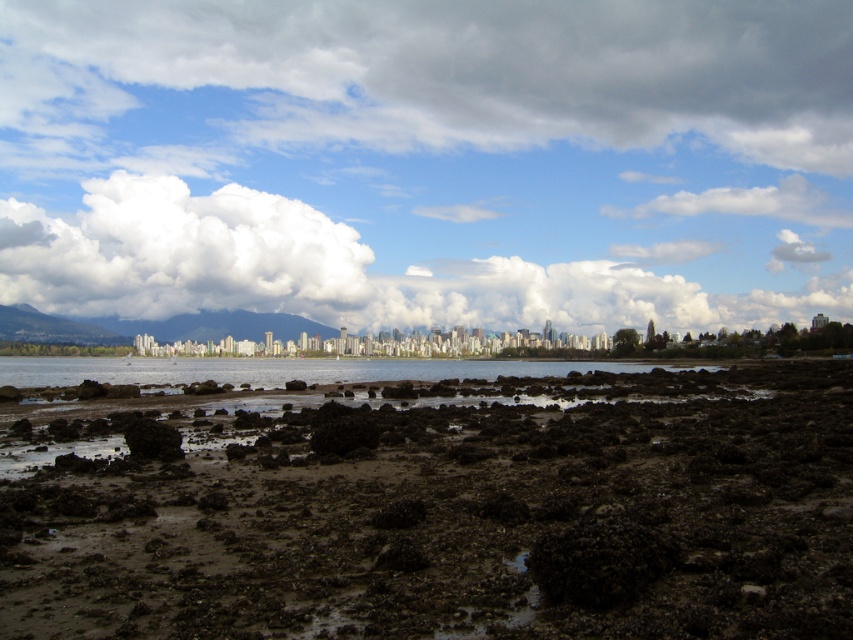
Question: Among these objects, which one is nearest to the camera?

Choices:
 (A) white fluffy cloud at upper left
 (B) clear water at center

Answer: (B)

Question: Which is nearer to the cloudy sky at upper center?

Choices:
 (A) clear water at center
 (B) white fluffy cloud at upper left

Answer: (B)

Question: Which object appears closest to the camera in this image?

Choices:
 (A) cloudy sky at upper center
 (B) clear water at center
 (C) white fluffy cloud at upper left
 (D) dull brown mud at center

Answer: (D)

Question: Can you confirm if cloudy sky at upper center is bigger than clear water at center?

Choices:
 (A) no
 (B) yes

Answer: (B)

Question: Does cloudy sky at upper center appear on the right side of white fluffy cloud at upper left?

Choices:
 (A) yes
 (B) no

Answer: (A)

Question: Observing the image, what is the correct spatial positioning of dull brown mud at center in reference to white fluffy cloud at upper left?

Choices:
 (A) right
 (B) left

Answer: (A)